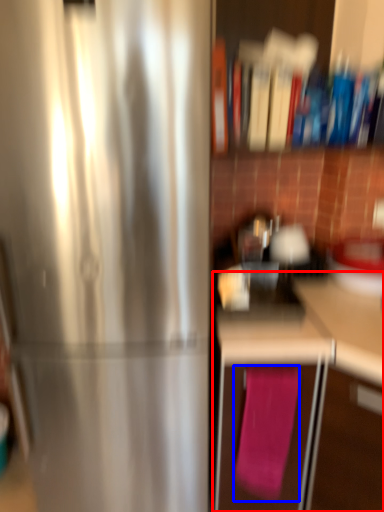
Question: Which point is closer to the camera, cabinetry (highlighted by a red box) or bath towel (highlighted by a blue box)?

Choices:
 (A) cabinetry
 (B) bath towel

Answer: (A)